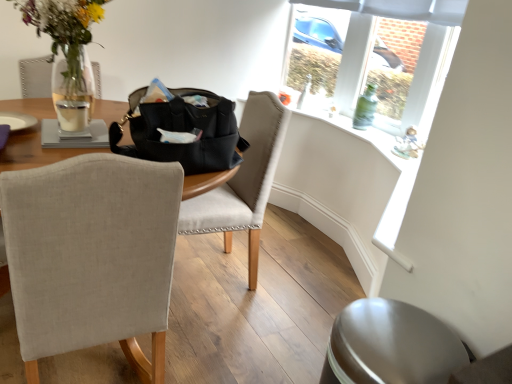
Locate an element on the screen. The image size is (512, 384). free space below light beige fabric chair at center, arranged as the 2th chair when viewed from the front (from a real-world perspective) is located at coordinates click(x=207, y=281).